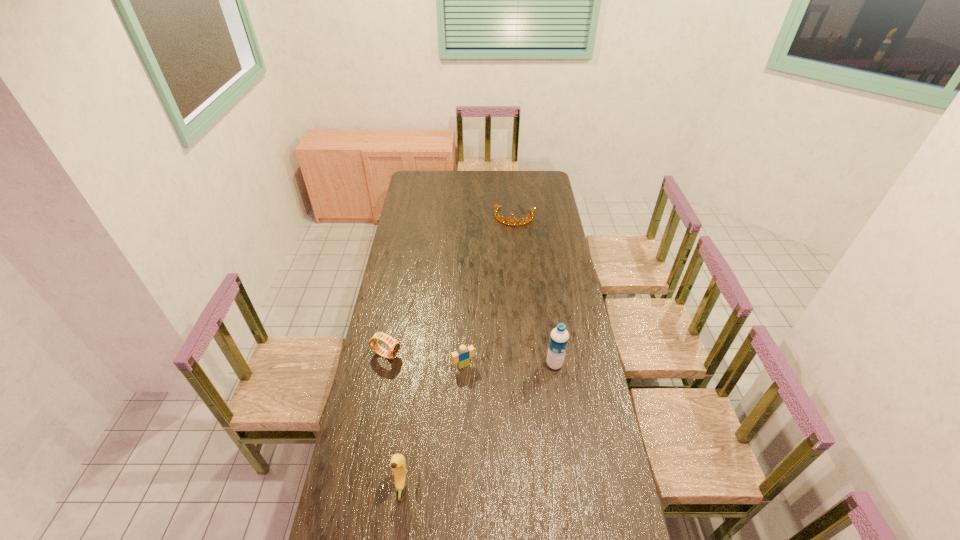
This screenshot has width=960, height=540. In order to click on banana in this screenshot , I will do `click(398, 464)`.

The width and height of the screenshot is (960, 540). What are the coordinates of `the second object from left to right` in the screenshot? It's located at (398, 464).

Locate an element on the screen. the tallest object is located at coordinates (559, 336).

Where is `tiara`? Image resolution: width=960 pixels, height=540 pixels. tiara is located at coordinates (496, 207).

Locate an element on the screen. the shortest object is located at coordinates click(496, 207).

You are a GUI agent. You are given a task and a screenshot of the screen. Output one action in this format:
    pyautogui.click(x=<x>, y=<y>)
    Task: Click on the third object from left to right
    The width and height of the screenshot is (960, 540).
    Given the screenshot: What is the action you would take?
    pyautogui.click(x=462, y=357)

Image resolution: width=960 pixels, height=540 pixels. I want to click on watch, so click(x=393, y=345).

I want to click on vacant space situated 0.130m on the front-facing side of the farthest object, so click(508, 241).

The image size is (960, 540). I want to click on vacant space situated on the front-facing side of the farthest object, so click(507, 248).

Identify the location of free space located on the front-facing side of the farthest object. (507, 246).